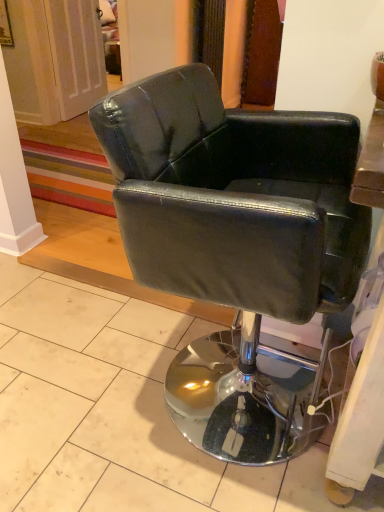
Describe the element at coordinates (237, 246) in the screenshot. The image size is (384, 512). I see `black leather chair at center` at that location.

Identify the location of black leather chair at center. (237, 246).

Find the location of a particular element. This screenshot has width=384, height=512. black leather chair at center is located at coordinates (237, 246).